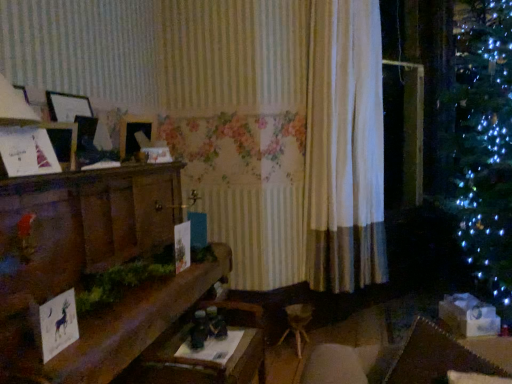
The image size is (512, 384). What do you see at coordinates (93, 264) in the screenshot?
I see `wooden mantelpiece at left` at bounding box center [93, 264].

In order to face white fabric curtain at center, should I rotate leftwards or rightwards?

Turn right by 13.071 degrees to look at white fabric curtain at center.

What do you see at coordinates (345, 148) in the screenshot?
I see `white fabric curtain at center` at bounding box center [345, 148].

Describe the element at coordinates (58, 324) in the screenshot. I see `white paper card at lower left, acting as the second christmas card starting from the back` at that location.

The image size is (512, 384). Identify the location of white paper christmas card at left, the second christmas card when ordered from right to left. (27, 151).

At what (x,y) coordinates should I click in order to perform the action: click on furniture that is above the wooden table at center (from a real-world perspective). Please return your answer as a coordinate pair (x, y). Image resolution: width=512 pixels, height=384 pixels. Looking at the image, I should click on (93, 264).

From the picture: Is wooden table at center taller or shorter than wooden mantelpiece at left?

Clearly, wooden table at center is shorter compared to wooden mantelpiece at left.

Which is in front, point (145, 357) or point (11, 337)?

The point (11, 337) is in front.

Looking at this image, considering the relative sizes of white paper christmas card at left, which is the 1th christmas card in left-to-right order, and white paper card at lower left, the 1th christmas card viewed from the right, in the image provided, is white paper christmas card at left, which is the 1th christmas card in left-to-right order, taller than white paper card at lower left, the 1th christmas card viewed from the right,?

No.

This screenshot has width=512, height=384. Find the location of `christmas card that appears in front of the white paper christmas card at left, the first christmas card from the top`. christmas card that appears in front of the white paper christmas card at left, the first christmas card from the top is located at coordinates (58, 324).

Does white paper christmas card at left, which is the 1th christmas card in left-to-right order, turn towards white paper card at lower left, acting as the second christmas card starting from the back?

No, white paper christmas card at left, which is the 1th christmas card in left-to-right order, is not aimed at white paper card at lower left, acting as the second christmas card starting from the back.

In the scene shown: Is white paper christmas card at left, marked as the 1th christmas card in a back-to-front arrangement, inside or outside of wooden mantelpiece at left?

The correct answer is: outside.

Does white paper christmas card at left, the first christmas card from the top, have a lesser height compared to wooden mantelpiece at left?

Correct, white paper christmas card at left, the first christmas card from the top, is not as tall as wooden mantelpiece at left.

Is point (22, 151) farther from viewer compared to point (80, 194)?

No.

You are a GUI agent. You are given a task and a screenshot of the screen. Output one action in this format:
    pyautogui.click(x=<x>, y=<y>)
    Task: Click on the christmas card on the left of wooden mantelpiece at left
    This screenshot has height=384, width=512.
    Given the screenshot: What is the action you would take?
    pyautogui.click(x=27, y=151)

Is white fabric curtain at center in front of or behind white paper christmas card at left, which is the 1th christmas card in left-to-right order, in the image?

Clearly, white fabric curtain at center is behind white paper christmas card at left, which is the 1th christmas card in left-to-right order.

Is white fabric curtain at center to the left or to the right of white paper christmas card at left, marked as the 2th christmas card in a bottom-to-top arrangement, in the image?

Based on their positions, white fabric curtain at center is located to the right of white paper christmas card at left, marked as the 2th christmas card in a bottom-to-top arrangement.

Is white fabric curtain at center with white paper christmas card at left, the second christmas card when ordered from right to left?

white fabric curtain at center and white paper christmas card at left, the second christmas card when ordered from right to left, are not in contact.

Consider the image. Is white fabric curtain at center looking in the opposite direction of white paper christmas card at left, the first christmas card from the top?

No, white fabric curtain at center's orientation is not away from white paper christmas card at left, the first christmas card from the top.

Is wooden table at center at the right side of white paper christmas card at left, the first christmas card from the top?

Yes.

Is wooden table at center looking in the opposite direction of white paper christmas card at left, the first christmas card from the top?

No, white paper christmas card at left, the first christmas card from the top, is not at the back of wooden table at center.

Considering the relative positions of wooden table at center and white paper christmas card at left, the first christmas card from the top, in the image provided, is wooden table at center in front of white paper christmas card at left, the first christmas card from the top,?

No, wooden table at center is behind white paper christmas card at left, the first christmas card from the top.

Between wooden table at center and white paper christmas card at left, the second christmas card from the front, which one has less height?

Standing shorter between the two is white paper christmas card at left, the second christmas card from the front.

You are a GUI agent. You are given a task and a screenshot of the screen. Output one action in this format:
    pyautogui.click(x=<x>, y=<y>)
    Task: Click on the christmas card that is the 1st one when counting backward from the wooden mantelpiece at left
    This screenshot has width=512, height=384.
    Given the screenshot: What is the action you would take?
    pyautogui.click(x=58, y=324)

Between wooden mantelpiece at left and white paper card at lower left, the 1th christmas card positioned from the bottom, which one has more height?

wooden mantelpiece at left.

How far apart are wooden mantelpiece at left and white paper card at lower left, the 2th christmas card in the left-to-right sequence?

The distance of wooden mantelpiece at left from white paper card at lower left, the 2th christmas card in the left-to-right sequence, is 15.16 inches.

Looking at this image, which is more to the right, wooden mantelpiece at left or white paper card at lower left, which is the 2th christmas card in top-to-bottom order?

From the viewer's perspective, white paper card at lower left, which is the 2th christmas card in top-to-bottom order, appears more on the right side.

Which point is more distant from viewer, (44, 356) or (39, 146)?

The point (39, 146) is farther.

Are white paper card at lower left, acting as the second christmas card starting from the back, and white paper christmas card at left, marked as the 1th christmas card in a back-to-front arrangement, far apart?

They are positioned close to each other.

Is white paper card at lower left, the 1th christmas card positioned from the bottom, aimed at white paper christmas card at left, which is the 1th christmas card in left-to-right order?

No, white paper card at lower left, the 1th christmas card positioned from the bottom, is not facing towards white paper christmas card at left, which is the 1th christmas card in left-to-right order.

Would you say white paper card at lower left, the 1th christmas card positioned from the bottom, is outside white paper christmas card at left, the first christmas card from the top?

Yes, white paper card at lower left, the 1th christmas card positioned from the bottom, is outside of white paper christmas card at left, the first christmas card from the top.

Find the location of `furniture on the left of the wooden table at center`. furniture on the left of the wooden table at center is located at coordinates (93, 264).

Find the location of `christmas card above the white paper card at lower left, the 1th christmas card viewed from the right (from a real-world perspective)`. christmas card above the white paper card at lower left, the 1th christmas card viewed from the right (from a real-world perspective) is located at coordinates (27, 151).

Looking at the image, which one is located closer to wooden table at center, white paper card at lower left, the 1th christmas card positioned from the bottom, or white fabric curtain at center?

Based on the image, white paper card at lower left, the 1th christmas card positioned from the bottom, appears to be nearer to wooden table at center.

Looking at the image, which one is located further to white fabric curtain at center, wooden mantelpiece at left or white paper christmas card at left, the first christmas card from the top?

white paper christmas card at left, the first christmas card from the top.

From the image, which object appears to be nearer to white fabric curtain at center, white paper card at lower left, which is the 2th christmas card in top-to-bottom order, or wooden table at center?

wooden table at center lies closer to white fabric curtain at center than the other object.

Estimate the real-world distances between objects in this image. Which object is further from wooden table at center, white fabric curtain at center or white paper card at lower left, which is the 2th christmas card in top-to-bottom order?

white fabric curtain at center is further to wooden table at center.

Considering their positions, is wooden table at center positioned further to white paper christmas card at left, the first christmas card from the top, than white paper card at lower left, the 1th christmas card positioned from the bottom?

The object further to white paper christmas card at left, the first christmas card from the top, is wooden table at center.

Which object lies nearer to the anchor point wooden table at center, wooden mantelpiece at left or white fabric curtain at center?

Among the two, wooden mantelpiece at left is located nearer to wooden table at center.

Looking at the image, which one is located closer to white paper christmas card at left, the second christmas card from the front, white paper card at lower left, the first christmas card in the front-to-back sequence, or wooden mantelpiece at left?

Among the two, wooden mantelpiece at left is located nearer to white paper christmas card at left, the second christmas card from the front.

Looking at the image, which one is located further to wooden mantelpiece at left, wooden table at center or white fabric curtain at center?

white fabric curtain at center.

Where is `furniture between white paper christmas card at left, marked as the 2th christmas card in a bottom-to-top arrangement, and wooden table at center in the up-down direction`? This screenshot has width=512, height=384. furniture between white paper christmas card at left, marked as the 2th christmas card in a bottom-to-top arrangement, and wooden table at center in the up-down direction is located at coordinates (93, 264).

Where is `christmas card located between white paper card at lower left, which is the 2th christmas card in top-to-bottom order, and white fabric curtain at center in the depth direction`? The image size is (512, 384). christmas card located between white paper card at lower left, which is the 2th christmas card in top-to-bottom order, and white fabric curtain at center in the depth direction is located at coordinates (27, 151).

This screenshot has width=512, height=384. I want to click on table between white paper card at lower left, the 2th christmas card in the left-to-right sequence, and white fabric curtain at center in the front-back direction, so click(208, 359).

Identify the location of christmas card between white paper christmas card at left, the second christmas card when ordered from right to left, and wooden mantelpiece at left in the up-down direction. The height and width of the screenshot is (384, 512). (58, 324).